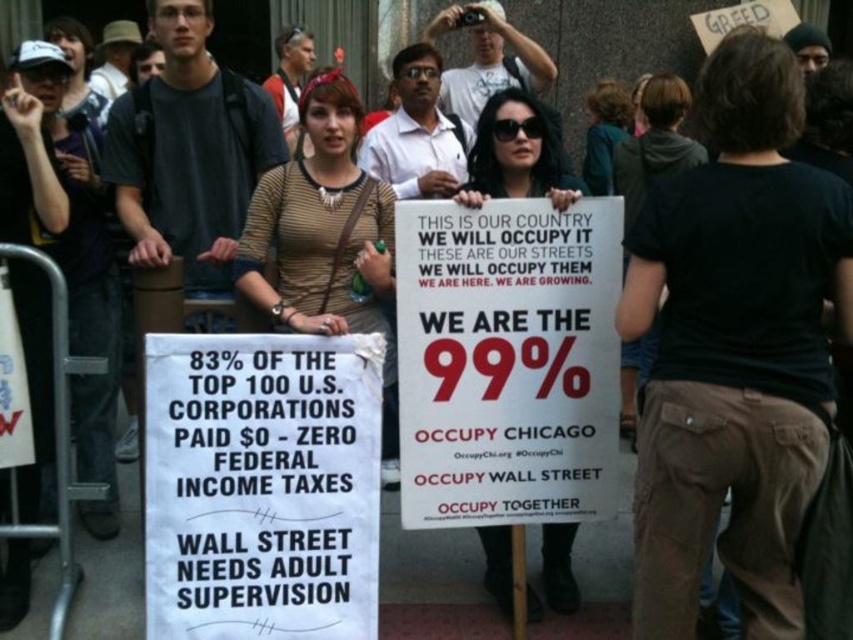
Does striped fabric shirt at center appear under matte white sign at center?

Correct, striped fabric shirt at center is located below matte white sign at center.

Who is higher up, striped fabric shirt at center or matte white sign at center?

matte white sign at center

Is point (326, 99) farther from viewer compared to point (544, 540)?

No, (326, 99) is in front of (544, 540).

Locate an element on the screen. striped fabric shirt at center is located at coordinates (325, 237).

In the scene shown: Is striped fabric shirt at center in front of black cotton shirt at upper right?

Yes, striped fabric shirt at center is closer to the viewer.

Which is more to the left, striped fabric shirt at center or black cotton shirt at upper right?

striped fabric shirt at center is more to the left.

At what (x,y) coordinates should I click in order to perform the action: click on striped fabric shirt at center. Please return your answer as a coordinate pair (x, y). This screenshot has width=853, height=640. Looking at the image, I should click on (325, 237).

Is white paper sign at center smaller than black cotton shirt at upper right?

Indeed, white paper sign at center has a smaller size compared to black cotton shirt at upper right.

At what (x,y) coordinates should I click in order to perform the action: click on white paper sign at center. Please return your answer as a coordinate pair (x, y). This screenshot has width=853, height=640. Looking at the image, I should click on (508, 362).

Locate an element on the screen. The image size is (853, 640). white paper sign at center is located at coordinates [x=508, y=362].

I want to click on white paper sign at center, so click(x=508, y=362).